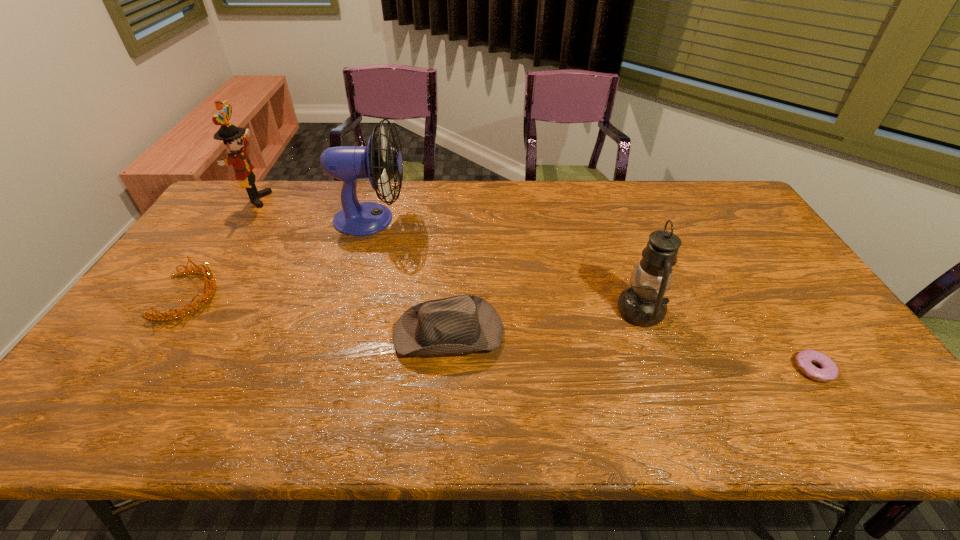
At what (x,y) coordinates should I click in order to perform the action: click on object at the far left corner. Please return your answer as a coordinate pair (x, y). Looking at the image, I should click on (231, 135).

Locate an element on the screen. free spot at the far edge of the desktop is located at coordinates (640, 213).

This screenshot has height=540, width=960. What are the coordinates of `vacant space at the near edge` in the screenshot? It's located at (776, 397).

Where is `vacant region at the left edge`? This screenshot has height=540, width=960. vacant region at the left edge is located at coordinates click(x=180, y=335).

Identify the location of vacant space at the right edge. This screenshot has height=540, width=960. (768, 279).

Where is `free point between the third object from right to left and the nutcracker`? The image size is (960, 540). free point between the third object from right to left and the nutcracker is located at coordinates (352, 265).

At what (x,y) coordinates should I click in order to perform the action: click on free space between the third object from left to right and the second object from right to left. Please return your answer as a coordinate pair (x, y). Looking at the image, I should click on (506, 265).

Locate an element on the screen. Image resolution: width=960 pixels, height=540 pixels. free spot between the fan and the nutcracker is located at coordinates (313, 209).

At what (x,y) coordinates should I click in order to perform the action: click on vacant space that's between the fourth shortest object and the shortest object. Please return your answer as a coordinate pair (x, y). The height and width of the screenshot is (540, 960). Looking at the image, I should click on (728, 340).

Locate an element on the screen. free space between the fan and the fedora is located at coordinates (410, 275).